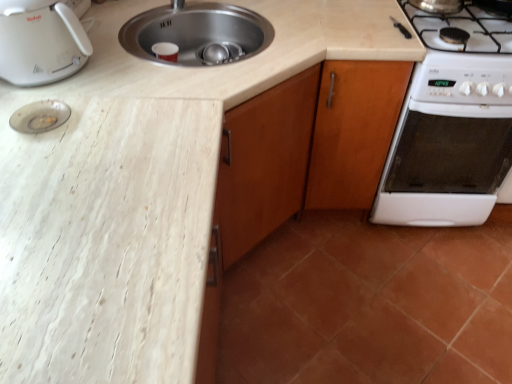
Question: Is terracotta tile at lower right thinner than white plastic toaster at upper left?

Choices:
 (A) no
 (B) yes

Answer: (A)

Question: Is terracotta tile at lower right closer to the viewer compared to white plastic toaster at upper left?

Choices:
 (A) no
 (B) yes

Answer: (A)

Question: Is terracotta tile at lower right at the left side of white plastic toaster at upper left?

Choices:
 (A) no
 (B) yes

Answer: (A)

Question: Does terracotta tile at lower right lie behind white plastic toaster at upper left?

Choices:
 (A) no
 (B) yes

Answer: (B)

Question: Does terracotta tile at lower right have a smaller size compared to white plastic toaster at upper left?

Choices:
 (A) yes
 (B) no

Answer: (B)

Question: Considering the relative positions of transparent glass plate at upper left and white plastic toaster at upper left in the image provided, is transparent glass plate at upper left to the left or to the right of white plastic toaster at upper left?

Choices:
 (A) left
 (B) right

Answer: (B)

Question: Is point (15, 120) closer or farther from the camera than point (25, 69)?

Choices:
 (A) farther
 (B) closer

Answer: (B)

Question: Is transparent glass plate at upper left in front of or behind white plastic toaster at upper left in the image?

Choices:
 (A) behind
 (B) front

Answer: (A)

Question: Considering the positions of transparent glass plate at upper left and white plastic toaster at upper left in the image, is transparent glass plate at upper left wider or thinner than white plastic toaster at upper left?

Choices:
 (A) wide
 (B) thin

Answer: (B)

Question: Considering the positions of white glossy oven at right and wooden cabinet at right in the image, is white glossy oven at right wider or thinner than wooden cabinet at right?

Choices:
 (A) thin
 (B) wide

Answer: (A)

Question: Do you think white glossy oven at right is within wooden cabinet at right, or outside of it?

Choices:
 (A) outside
 (B) inside

Answer: (A)

Question: Is white glossy oven at right taller or shorter than wooden cabinet at right?

Choices:
 (A) tall
 (B) short

Answer: (B)

Question: From a real-world perspective, is white glossy oven at right above or below wooden cabinet at right?

Choices:
 (A) below
 (B) above

Answer: (A)

Question: From their relative heights in the image, would you say terracotta tile at lower right is taller or shorter than transparent glass plate at upper left?

Choices:
 (A) short
 (B) tall

Answer: (B)

Question: Considering the positions of point (270, 382) and point (32, 112), is point (270, 382) closer or farther from the camera than point (32, 112)?

Choices:
 (A) closer
 (B) farther

Answer: (B)